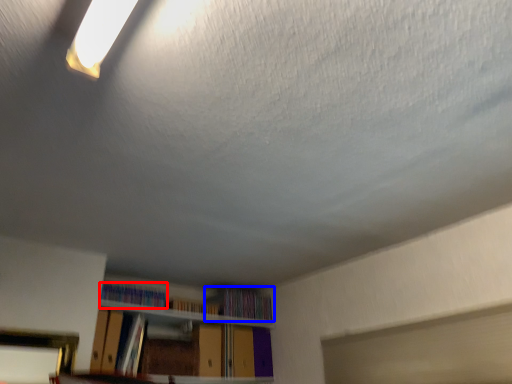
Question: Which object is closer to the camera taking this photo, book (highlighted by a red box) or book (highlighted by a blue box)?

Choices:
 (A) book
 (B) book

Answer: (A)